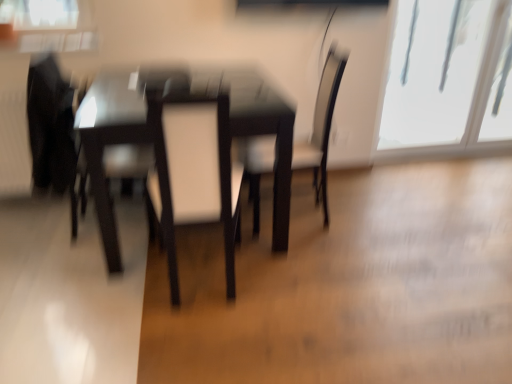
Image resolution: width=512 pixels, height=384 pixels. What do you see at coordinates (109, 144) in the screenshot? I see `glossy dark wood table at center` at bounding box center [109, 144].

Image resolution: width=512 pixels, height=384 pixels. Identify the location of matte black swivel chair at left, which is the 1th swivel chair from left to right. (50, 125).

What do you see at coordinates (50, 125) in the screenshot? This screenshot has height=384, width=512. I see `matte black swivel chair at left, acting as the second swivel chair starting from the right` at bounding box center [50, 125].

Measure the distance between point [176,303] and camera.

Point [176,303] and camera are 5.95 feet apart.

Where is `glossy dark wood table at center`? glossy dark wood table at center is located at coordinates (109, 144).

Considering the sizes of objects matte black chair at center and white leather swivel chair at center, marked as the 2th swivel chair in a left-to-right arrangement, in the image provided, who is wider, matte black chair at center or white leather swivel chair at center, marked as the 2th swivel chair in a left-to-right arrangement,?

Wider between the two is matte black chair at center.

Is point (254, 222) less distant than point (179, 139)?

No.

Who is bigger, matte black chair at center or white leather swivel chair at center, marked as the 2th swivel chair in a left-to-right arrangement?

matte black chair at center is bigger.

Which is in front, point (50, 135) or point (212, 96)?

The point (212, 96) is in front.

Which object is positioned more to the left, matte black swivel chair at left, which is the 1th swivel chair from left to right, or white leather swivel chair at center, marked as the 2th swivel chair in a left-to-right arrangement?

matte black swivel chair at left, which is the 1th swivel chair from left to right, is more to the left.

Can you tell me how much matte black swivel chair at left, acting as the second swivel chair starting from the right, and matte black chair at center differ in facing direction?

They differ by 175 degrees in their facing directions.

Considering the relative positions of matte black swivel chair at left, which is the 1th swivel chair from left to right, and matte black chair at center in the image provided, is matte black swivel chair at left, which is the 1th swivel chair from left to right, to the left or to the right of matte black chair at center?

In the image, matte black swivel chair at left, which is the 1th swivel chair from left to right, appears on the left side of matte black chair at center.

At what (x,y) coordinates should I click in order to perform the action: click on swivel chair above the matte black chair at center (from the image's perspective). Please return your answer as a coordinate pair (x, y). The image size is (512, 384). Looking at the image, I should click on tap(50, 125).

Could you tell me if matte black swivel chair at left, acting as the second swivel chair starting from the right, is turned towards matte black chair at center?

Yes.

Is glossy dark wood table at center wider than white leather swivel chair at center, marked as the 2th swivel chair in a left-to-right arrangement?

Yes.

Measure the distance from glossy dark wood table at center to white leather swivel chair at center, marked as the 2th swivel chair in a left-to-right arrangement.

12.44 inches.

Is point (93, 159) more distant than point (172, 184)?

Yes.

Would you say glossy dark wood table at center is a long distance from white leather swivel chair at center, arranged as the first swivel chair when viewed from the right?

That's not correct — glossy dark wood table at center is a little close to white leather swivel chair at center, arranged as the first swivel chair when viewed from the right.

From the picture: Between transparent glass window at upper right and matte black chair at center, which one has less height?

matte black chair at center is shorter.

Is transparent glass window at upper right bigger than matte black chair at center?

Yes.

Does point (461, 91) come farther from viewer compared to point (320, 124)?

Yes, point (461, 91) is farther from viewer.

How different are the orientations of transparent glass window at upper right and matte black chair at center in degrees?

The angle between the facing direction of transparent glass window at upper right and the facing direction of matte black chair at center is 94.3 degrees.

From a real-world perspective, relative to transparent glass window at upper right, is glossy dark wood table at center vertically above or below?

In terms of real-world spatial position, glossy dark wood table at center is below transparent glass window at upper right.

Does glossy dark wood table at center have a larger size compared to transparent glass window at upper right?

Yes, glossy dark wood table at center is bigger than transparent glass window at upper right.

How far apart are glossy dark wood table at center and transparent glass window at upper right?

They are 7.09 feet apart.

Which object is wider, glossy dark wood table at center or transparent glass window at upper right?

glossy dark wood table at center.

Consider the image. Could you tell me if matte black chair at center is facing matte black swivel chair at left, which is the 1th swivel chair from left to right?

Yes, matte black chair at center is turned towards matte black swivel chair at left, which is the 1th swivel chair from left to right.

How many degrees apart are the facing directions of matte black chair at center and matte black swivel chair at left, which is the 1th swivel chair from left to right?

175 degrees.

From a real-world perspective, which is physically above, matte black chair at center or matte black swivel chair at left, acting as the second swivel chair starting from the right?

matte black swivel chair at left, acting as the second swivel chair starting from the right, from a real-world perspective.

Which is closer to the camera, [273,152] or [59,94]?

The point [59,94] is closer.

The height and width of the screenshot is (384, 512). What are the coordinates of `chair located behind the white leather swivel chair at center, marked as the 2th swivel chair in a left-to-right arrangement` in the screenshot? It's located at (321, 128).

Locate an element on the screen. Image resolution: width=512 pixels, height=384 pixels. swivel chair lying in front of the matte black swivel chair at left, which is the 1th swivel chair from left to right is located at coordinates (193, 169).

Looking at the image, which one is located further to white leather swivel chair at center, arranged as the first swivel chair when viewed from the right, glossy dark wood table at center or matte black swivel chair at left, acting as the second swivel chair starting from the right?

Based on the image, matte black swivel chair at left, acting as the second swivel chair starting from the right, appears to be further to white leather swivel chair at center, arranged as the first swivel chair when viewed from the right.

In the scene shown: Based on their spatial positions, is white leather swivel chair at center, arranged as the first swivel chair when viewed from the right, or matte black chair at center further from glossy dark wood table at center?

Among the two, matte black chair at center is located further to glossy dark wood table at center.

In the scene shown: Estimate the real-world distances between objects in this image. Which object is further from glossy dark wood table at center, matte black chair at center or matte black swivel chair at left, acting as the second swivel chair starting from the right?

matte black chair at center is positioned further to the anchor glossy dark wood table at center.

When comparing their distances from white leather swivel chair at center, marked as the 2th swivel chair in a left-to-right arrangement, does glossy dark wood table at center or transparent glass window at upper right seem further?

transparent glass window at upper right lies further to white leather swivel chair at center, marked as the 2th swivel chair in a left-to-right arrangement, than the other object.

From the image, which object appears to be nearer to glossy dark wood table at center, matte black chair at center or white leather swivel chair at center, marked as the 2th swivel chair in a left-to-right arrangement?

The object closer to glossy dark wood table at center is white leather swivel chair at center, marked as the 2th swivel chair in a left-to-right arrangement.

Considering their positions, is matte black swivel chair at left, which is the 1th swivel chair from left to right, positioned closer to transparent glass window at upper right than matte black chair at center?

The object closer to transparent glass window at upper right is matte black chair at center.

Considering their positions, is matte black swivel chair at left, acting as the second swivel chair starting from the right, positioned closer to glossy dark wood table at center than transparent glass window at upper right?

matte black swivel chair at left, acting as the second swivel chair starting from the right, is closer to glossy dark wood table at center.

Estimate the real-world distances between objects in this image. Which object is closer to transparent glass window at upper right, glossy dark wood table at center or white leather swivel chair at center, arranged as the first swivel chair when viewed from the right?

The object closer to transparent glass window at upper right is white leather swivel chair at center, arranged as the first swivel chair when viewed from the right.

Find the location of a particular element. This screenshot has height=384, width=512. chair located between matte black swivel chair at left, acting as the second swivel chair starting from the right, and transparent glass window at upper right in the left-right direction is located at coordinates (321, 128).

Locate an element on the screen. swivel chair located between glossy dark wood table at center and matte black chair at center in the left-right direction is located at coordinates (193, 169).

The image size is (512, 384). I want to click on table located between matte black swivel chair at left, acting as the second swivel chair starting from the right, and matte black chair at center in the left-right direction, so click(109, 144).

Locate an element on the screen. swivel chair between matte black swivel chair at left, acting as the second swivel chair starting from the right, and transparent glass window at upper right is located at coordinates (193, 169).